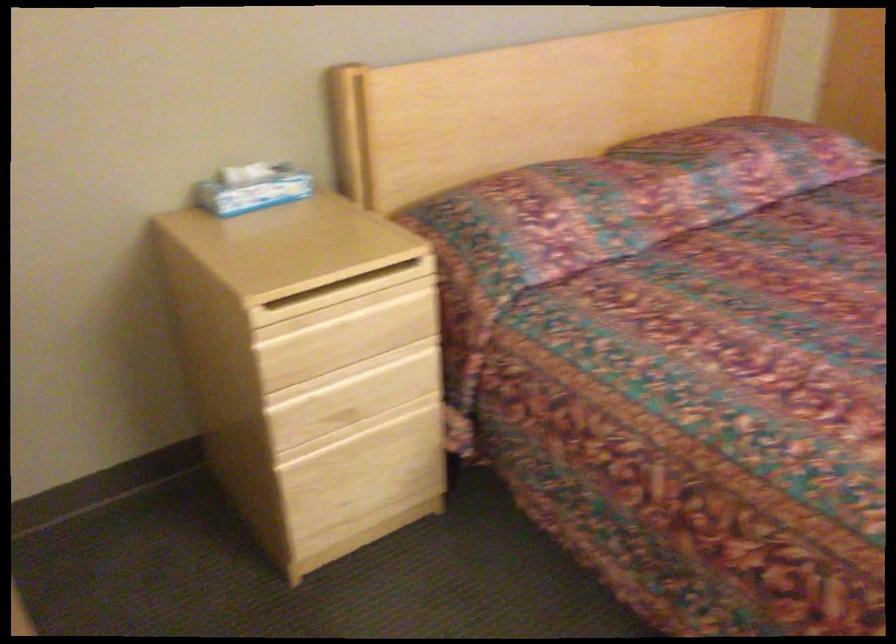
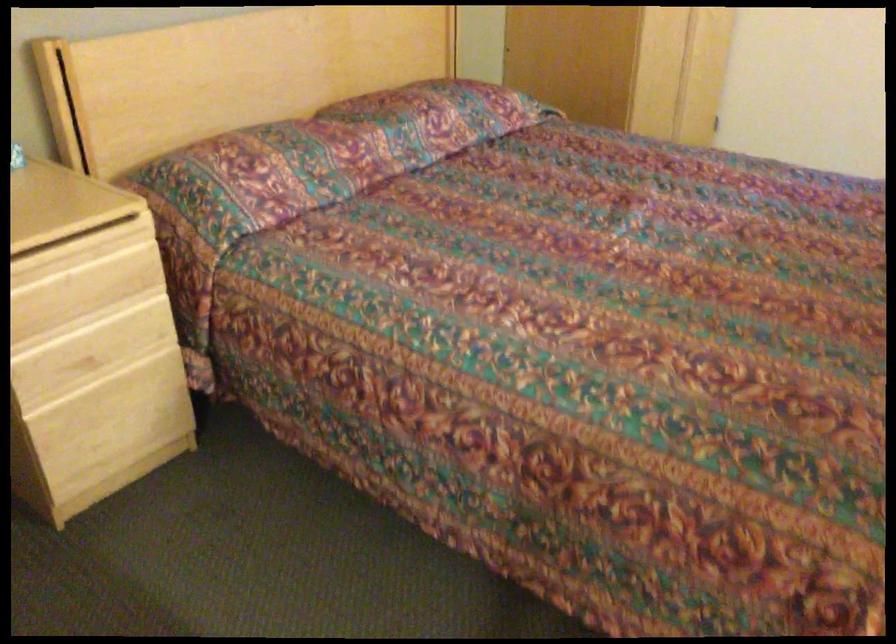
Question: In a continuous first-person perspective shot, in which direction is the camera moving?

Choices:
 (A) Left
 (B) Right
 (C) Forward
 (D) Backward

Answer: (D)